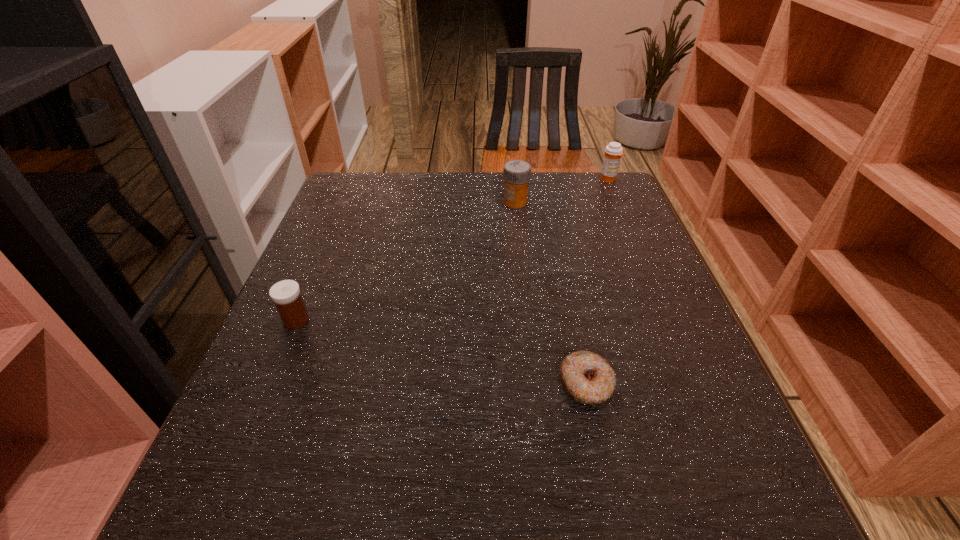
Where is `vacant region at the right edge of the desktop`? The width and height of the screenshot is (960, 540). vacant region at the right edge of the desktop is located at coordinates (658, 376).

The image size is (960, 540). In the image, there is a desktop. Identify the location of free space at the far right corner. (578, 206).

This screenshot has height=540, width=960. I want to click on vacant region at the near right corner, so click(704, 494).

I want to click on free spot between the leftmost object and the farthest object, so click(452, 250).

I want to click on vacant area that lies between the nearest object and the farthest object, so click(x=597, y=282).

In order to click on free spot between the third farthest object and the rightmost medicine in this screenshot , I will do `click(452, 250)`.

The width and height of the screenshot is (960, 540). I want to click on free spot between the second medicine from right to left and the nearest object, so click(551, 293).

Find the location of a particular element. The image size is (960, 540). free space between the second object from left to right and the third object from left to right is located at coordinates (551, 293).

Image resolution: width=960 pixels, height=540 pixels. In order to click on vacant space that's between the second medicine from left to right and the nearest object in this screenshot , I will do `click(551, 293)`.

Find the location of a particular element. This screenshot has width=960, height=540. empty space between the third object from left to right and the farthest medicine is located at coordinates (597, 282).